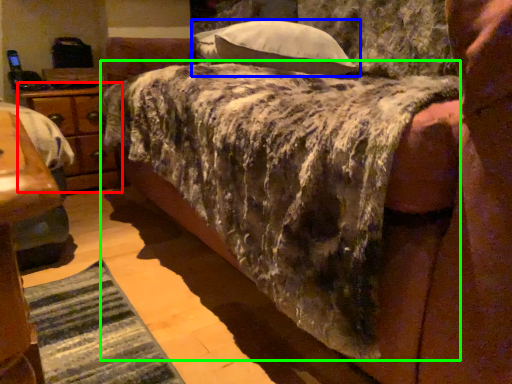
Question: Considering the real-world distances, which object is farthest from nightstand (highlighted by a red box)? pillow (highlighted by a blue box) or mattress (highlighted by a green box)?

Choices:
 (A) pillow
 (B) mattress

Answer: (B)